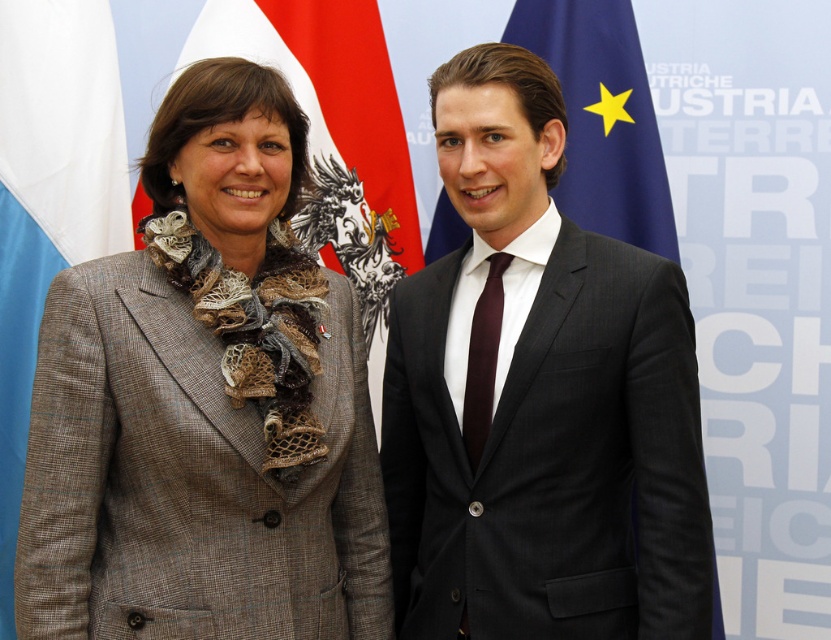
Question: Where is dark gray suit at center located in relation to burgundy silk tie at center in the image?

Choices:
 (A) left
 (B) right

Answer: (B)

Question: Can you confirm if dark gray suit at center is bigger than blue fabric flag at upper center?

Choices:
 (A) no
 (B) yes

Answer: (B)

Question: Considering the real-world distances, which object is farthest from the dark gray suit at center?

Choices:
 (A) red fabric flag at upper left
 (B) burgundy silk tie at center
 (C) plaid wool coat at center

Answer: (A)

Question: Which of the following is the closest to the observer?

Choices:
 (A) (266, 336)
 (B) (482, 83)
 (C) (364, 278)

Answer: (A)

Question: Is white fabric flag at left above burgundy silk tie at center?

Choices:
 (A) yes
 (B) no

Answer: (A)

Question: Among these points, which one is nearest to the camera?

Choices:
 (A) (475, 440)
 (B) (52, 100)
 (C) (514, 115)
 (D) (327, 429)

Answer: (D)